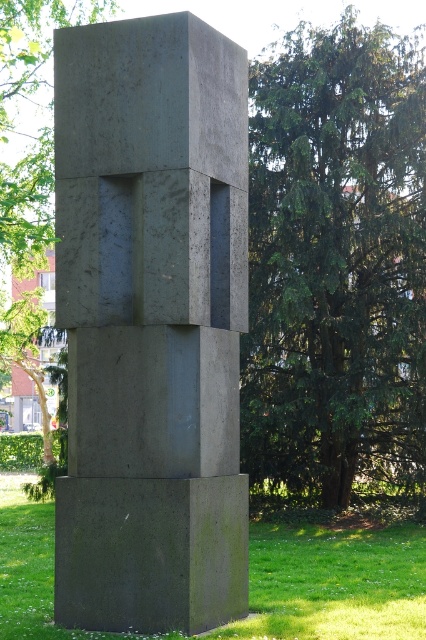
Question: Estimate the real-world distances between objects in this image. Which object is farther from the green textured tree at center?

Choices:
 (A) matte concrete sculpture at center
 (B) green leafy tree at upper center
 (C) green mossy stone at lower center

Answer: (A)

Question: Among these points, which one is nearest to the camera?

Choices:
 (A) (290, 637)
 (B) (13, 204)
 (C) (385, 291)
 (D) (92, 236)

Answer: (A)

Question: Is green mossy stone at lower center positioned before green leafy tree at upper center?

Choices:
 (A) yes
 (B) no

Answer: (A)

Question: Which point is farther from the camera taking this photo?

Choices:
 (A) (276, 561)
 (B) (342, 86)

Answer: (B)

Question: Is matte concrete sculpture at center in front of green mossy stone at lower center?

Choices:
 (A) yes
 (B) no

Answer: (B)

Question: Can you confirm if green textured tree at center is bigger than green mossy stone at lower center?

Choices:
 (A) no
 (B) yes

Answer: (A)